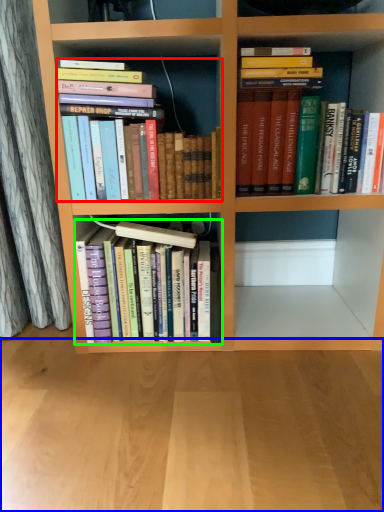
Question: Based on their relative distances, which object is farther from book (highlighted by a red box)? Choose from plain (highlighted by a blue box) and book (highlighted by a green box).

Choices:
 (A) plain
 (B) book

Answer: (A)